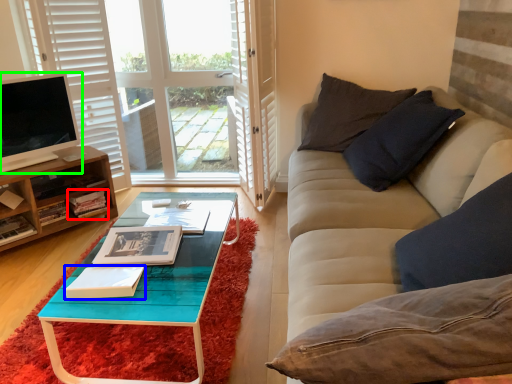
Question: Which object is the farthest from book (highlighted by a red box)? Choose among these: book (highlighted by a blue box) or television (highlighted by a green box).

Choices:
 (A) book
 (B) television

Answer: (A)